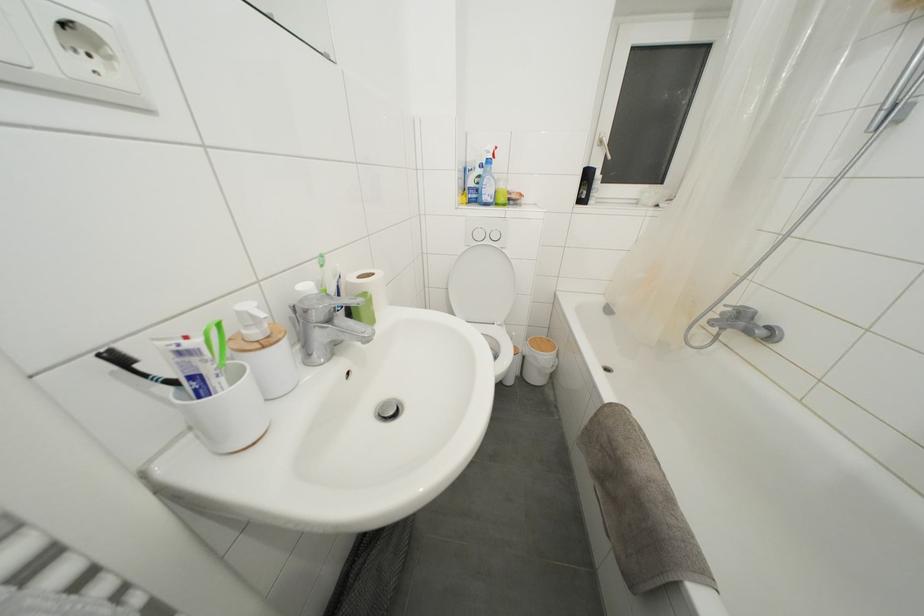
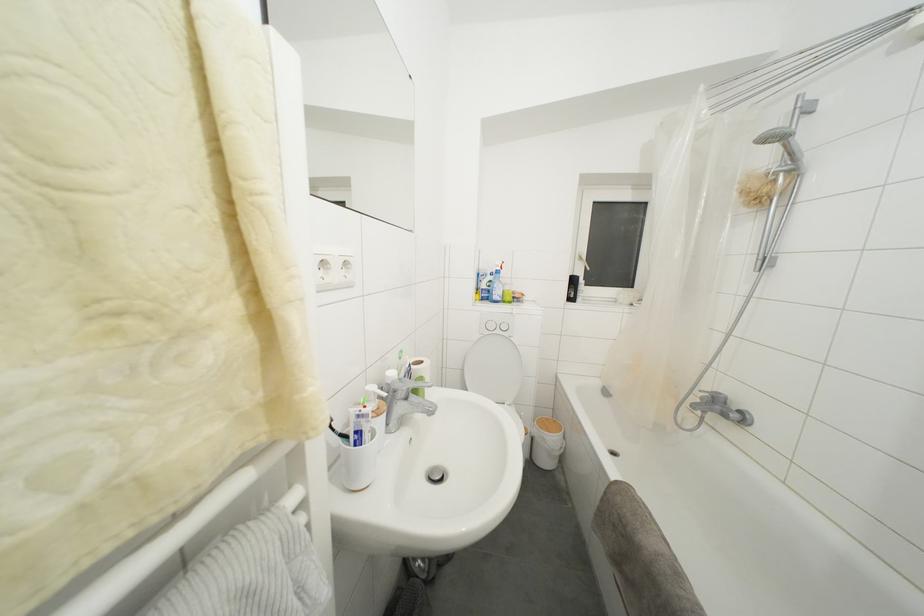
In the second image, find the point that corresponds to point 532,363 in the first image.

(541, 445)